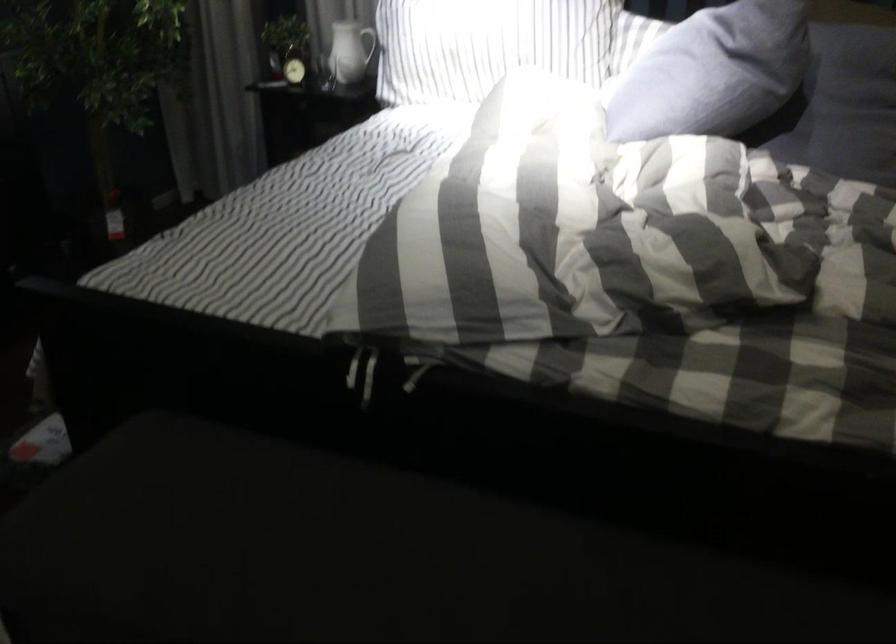
Describe the element at coordinates (371, 44) in the screenshot. Image resolution: width=896 pixels, height=644 pixels. I see `a pitcher handle` at that location.